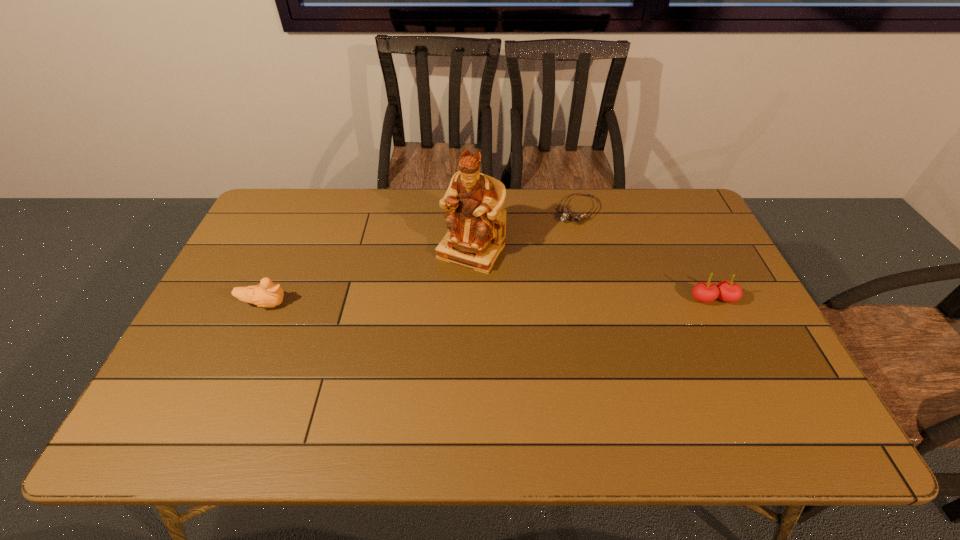
Locate an element on the screen. This screenshot has height=540, width=960. vacant point at the far left corner is located at coordinates (310, 206).

Where is `free space at the far right corner`? The height and width of the screenshot is (540, 960). free space at the far right corner is located at coordinates (670, 206).

Identify the location of free space at the near right corner of the desktop. This screenshot has height=540, width=960. (793, 387).

Identify the location of vacant space that is in between the second object from left to right and the farthest object. This screenshot has height=540, width=960. (524, 231).

Where is `free space between the duckling and the shortest object`? The width and height of the screenshot is (960, 540). free space between the duckling and the shortest object is located at coordinates (421, 258).

Image resolution: width=960 pixels, height=540 pixels. I want to click on free space between the leftmost object and the tallest object, so click(x=368, y=278).

Locate an element on the screen. Image resolution: width=960 pixels, height=540 pixels. unoccupied position between the cherry and the duckling is located at coordinates (489, 302).

In order to click on vacant region between the third object from left to right and the rightmost object in this screenshot , I will do `click(645, 255)`.

The height and width of the screenshot is (540, 960). I want to click on vacant area that lies between the shortest object and the rightmost object, so click(645, 255).

Where is `free area in between the shortest object and the figurine`? The image size is (960, 540). free area in between the shortest object and the figurine is located at coordinates (524, 231).